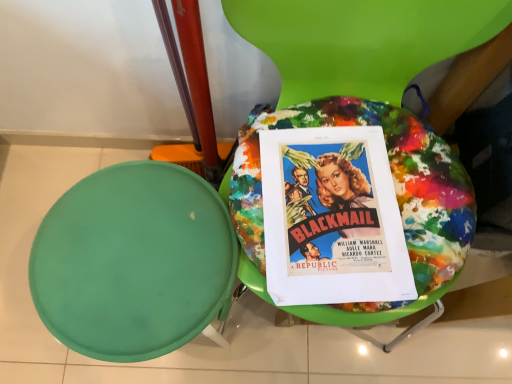
Based on the photo, what is the approximate width of vibrant paper poster at center?

vibrant paper poster at center is 30.81 centimeters in width.

Identify the location of green matte stool at left. The height and width of the screenshot is (384, 512). (133, 262).

Does point (323, 86) come closer to viewer compared to point (135, 224)?

No, it is not.

Looking at their sizes, would you say paint splattered fabric cushion at center is wider or thinner than green matte stool at left?

paint splattered fabric cushion at center is wider than green matte stool at left.

From a real-world perspective, which object rests below the other?

From a 3D spatial view, green matte stool at left is below.

From the image's perspective, which one is positioned higher, paint splattered fabric cushion at center or green matte stool at left?

From the image's view, paint splattered fabric cushion at center is above.

What's the angular difference between green matte stool at left and vibrant paper poster at center's facing directions?

There is a 3.41-degree angle between the facing directions of green matte stool at left and vibrant paper poster at center.

Considering the relative sizes of green matte stool at left and vibrant paper poster at center in the image provided, is green matte stool at left taller than vibrant paper poster at center?

Indeed, green matte stool at left has a greater height compared to vibrant paper poster at center.

Does green matte stool at left touch vibrant paper poster at center?

No, green matte stool at left is not making contact with vibrant paper poster at center.

From a real-world perspective, relative to vibrant paper poster at center, is green matte stool at left vertically above or below?

In terms of real-world spatial position, green matte stool at left is below vibrant paper poster at center.

Can you confirm if paint splattered fabric cushion at center is wider than vibrant paper poster at center?

Yes, paint splattered fabric cushion at center is wider than vibrant paper poster at center.

Could you tell me if paint splattered fabric cushion at center is turned towards vibrant paper poster at center?

Yes, paint splattered fabric cushion at center is aimed at vibrant paper poster at center.

How many degrees apart are the facing directions of paint splattered fabric cushion at center and vibrant paper poster at center?

The angle between the facing direction of paint splattered fabric cushion at center and the facing direction of vibrant paper poster at center is 1.72 degrees.

Can you confirm if paint splattered fabric cushion at center is bigger than vibrant paper poster at center?

Yes.

Is vibrant paper poster at center further to camera compared to paint splattered fabric cushion at center?

Yes, the depth of vibrant paper poster at center is greater than that of paint splattered fabric cushion at center.

Looking at this image, which is less distant, (x=406, y=296) or (x=319, y=45)?

Point (x=406, y=296).

From the image's perspective, between vibrant paper poster at center and paint splattered fabric cushion at center, which one is located above?

From the image's view, paint splattered fabric cushion at center is above.

Which object is closer to the camera, vibrant paper poster at center or green matte stool at left?

green matte stool at left is in front.

Considering the relative sizes of vibrant paper poster at center and green matte stool at left in the image provided, is vibrant paper poster at center shorter than green matte stool at left?

Indeed, vibrant paper poster at center has a lesser height compared to green matte stool at left.

Considering the relative sizes of vibrant paper poster at center and green matte stool at left in the image provided, is vibrant paper poster at center smaller than green matte stool at left?

Correct, vibrant paper poster at center occupies less space than green matte stool at left.

Is green matte stool at left positioned with its back to paint splattered fabric cushion at center?

No, green matte stool at left's orientation is not away from paint splattered fabric cushion at center.

Is green matte stool at left beside paint splattered fabric cushion at center?

green matte stool at left and paint splattered fabric cushion at center are not in contact.

Which of these two, green matte stool at left or paint splattered fabric cushion at center, stands taller?

With more height is paint splattered fabric cushion at center.

Where is `chair above the green matte stool at left (from a real-world perspective)`? chair above the green matte stool at left (from a real-world perspective) is located at coordinates (362, 118).

Where is `comic book located behind the green matte stool at left`? Image resolution: width=512 pixels, height=384 pixels. comic book located behind the green matte stool at left is located at coordinates (333, 218).

From the image, which object appears to be nearer to paint splattered fabric cushion at center, green matte stool at left or vibrant paper poster at center?

Based on the image, vibrant paper poster at center appears to be nearer to paint splattered fabric cushion at center.

Which object lies nearer to the anchor point vibrant paper poster at center, green matte stool at left or paint splattered fabric cushion at center?

paint splattered fabric cushion at center is closer to vibrant paper poster at center.

In the scene shown: Based on their spatial positions, is paint splattered fabric cushion at center or vibrant paper poster at center closer to green matte stool at left?

Based on the image, vibrant paper poster at center appears to be nearer to green matte stool at left.

When comparing their distances from green matte stool at left, does vibrant paper poster at center or paint splattered fabric cushion at center seem further?

paint splattered fabric cushion at center is further to green matte stool at left.

Considering their positions, is vibrant paper poster at center positioned closer to paint splattered fabric cushion at center than green matte stool at left?

vibrant paper poster at center is closer to paint splattered fabric cushion at center.

From the image, which object appears to be farther from vibrant paper poster at center, paint splattered fabric cushion at center or green matte stool at left?

The object further to vibrant paper poster at center is green matte stool at left.

At what (x,y) coordinates should I click in order to perform the action: click on round table between paint splattered fabric cushion at center and vibrant paper poster at center from front to back. Please return your answer as a coordinate pair (x, y). The height and width of the screenshot is (384, 512). Looking at the image, I should click on (133, 262).